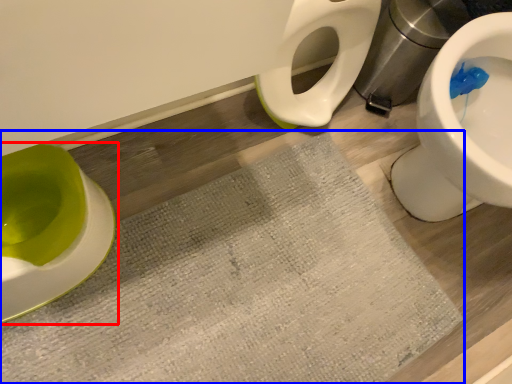
Question: Which object is closer to the camera taking this photo, toilet (highlighted by a red box) or bath mat (highlighted by a blue box)?

Choices:
 (A) toilet
 (B) bath mat

Answer: (A)